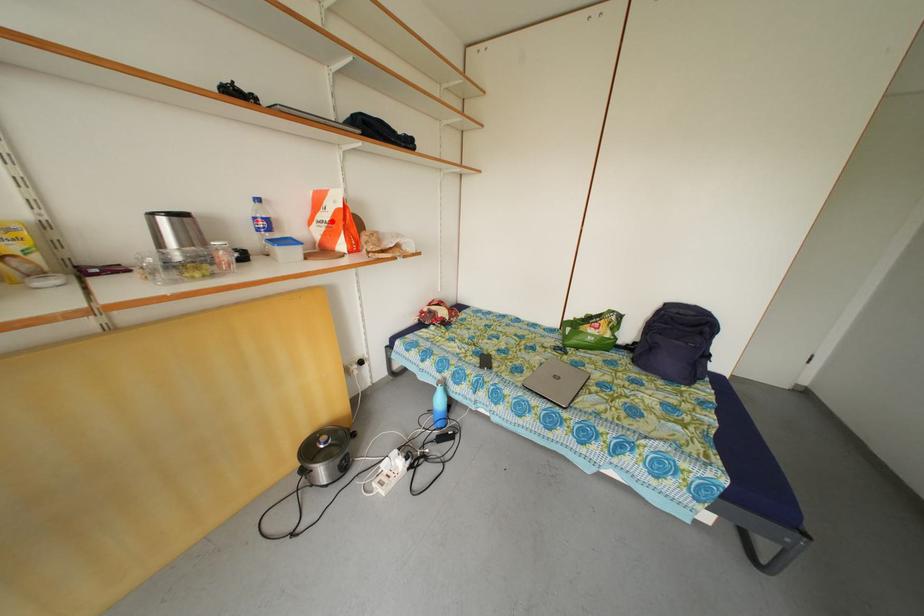
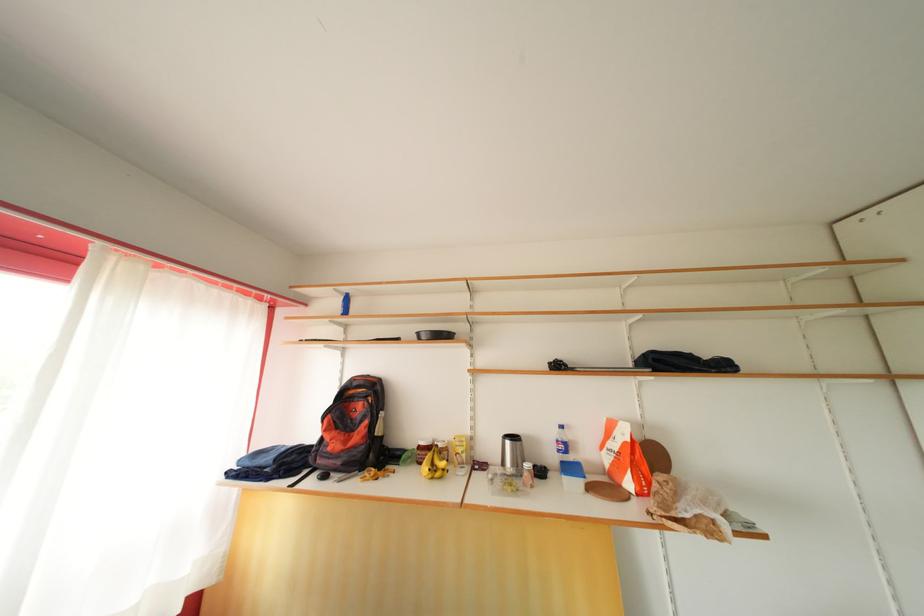
Question: A red point is marked in image1. In image2, is the corresponding 3D point closer to the camera or farther? Reply with the corresponding letter.

Choices:
 (A) The corresponding 3D point is closer.
 (B) The corresponding 3D point is farther.

Answer: (B)